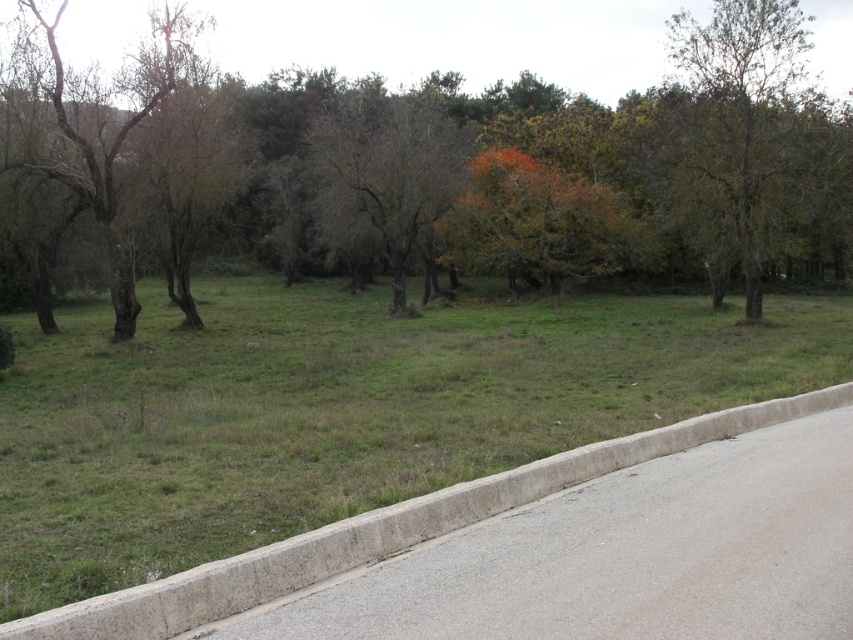
Question: Estimate the real-world distances between objects in this image. Which object is closer to the brown rough tree at upper right?

Choices:
 (A) bare branches at left
 (B) brown textured tree at center
 (C) green grass at center

Answer: (C)

Question: Observing the image, what is the correct spatial positioning of green grass at center in reference to brown rough tree at upper right?

Choices:
 (A) left
 (B) right

Answer: (A)

Question: Which object is farther from the camera taking this photo?

Choices:
 (A) brown textured tree at center
 (B) brown rough tree at upper right
 (C) green grass at center

Answer: (A)

Question: Where is brown rough tree at upper right located in relation to bare branches at left in the image?

Choices:
 (A) right
 (B) left

Answer: (A)

Question: Which point is closer to the camera?

Choices:
 (A) (408, 220)
 (B) (781, 145)
 (C) (694, 138)
 (D) (228, 301)

Answer: (B)

Question: Does brown rough tree at upper right appear over brown textured tree at center?

Choices:
 (A) yes
 (B) no

Answer: (A)